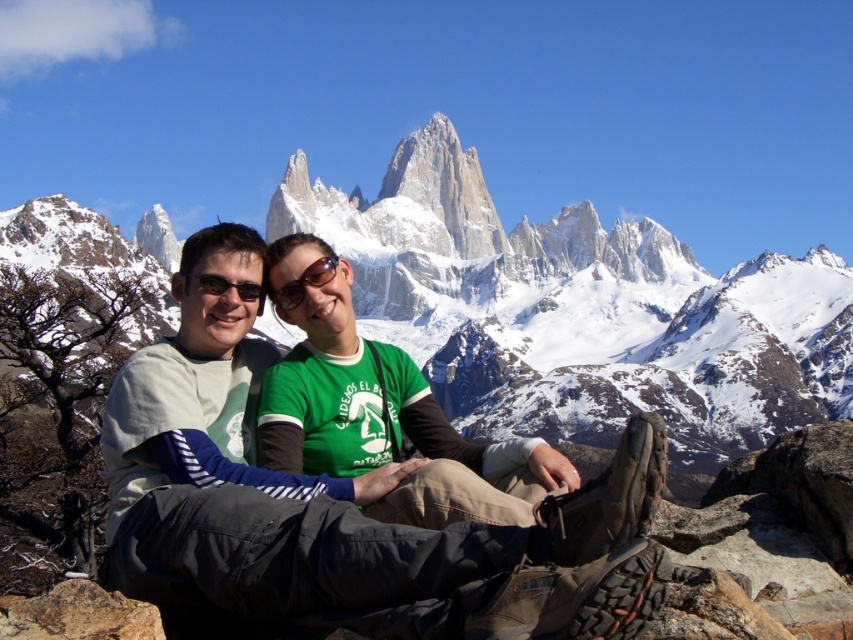
Is brown rough rock at lower left positioned before green matte sunglasses at center?

Yes, it is in front of green matte sunglasses at center.

Is brown rough rock at lower left thinner than green matte sunglasses at center?

Incorrect, brown rough rock at lower left's width is not less than green matte sunglasses at center's.

Locate an element on the screen. This screenshot has height=640, width=853. brown rough rock at lower left is located at coordinates (78, 614).

Which of these two, snowy granite mountain range at upper center or light gray fabric pants at center, stands shorter?

Standing shorter between the two is light gray fabric pants at center.

Between snowy granite mountain range at upper center and light gray fabric pants at center, which one appears on the left side from the viewer's perspective?

light gray fabric pants at center is more to the left.

Where is `snowy granite mountain range at upper center`? snowy granite mountain range at upper center is located at coordinates (578, 310).

Locate an element on the screen. This screenshot has height=640, width=853. snowy granite mountain range at upper center is located at coordinates (578, 310).

Who is more distant from viewer, (759, 259) or (85, 630)?

Point (759, 259)

Is point (527, 323) behind point (26, 598)?

That is True.

The image size is (853, 640). Identify the location of snowy granite mountain range at upper center. 578,310.